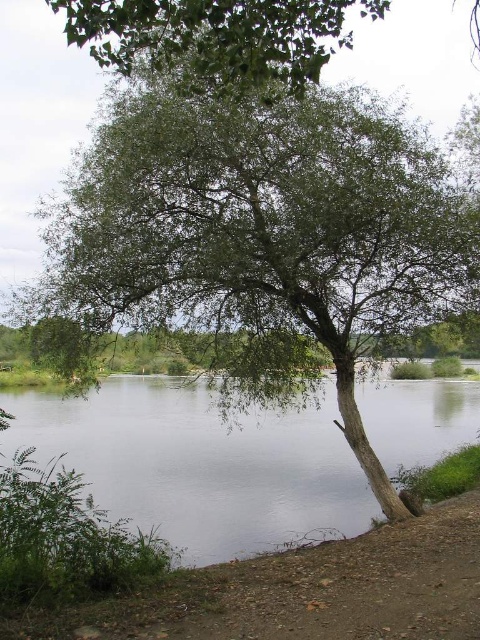
Locate an element on the screen. The width and height of the screenshot is (480, 640). clear water at center is located at coordinates (200, 465).

How distant is clear water at center from green leafy tree at upper center?

clear water at center and green leafy tree at upper center are 25.10 feet apart.

Who is more forward, [151,508] or [197,88]?

Result: Point [197,88] is more forward.

Locate an element on the screen. clear water at center is located at coordinates (200, 465).